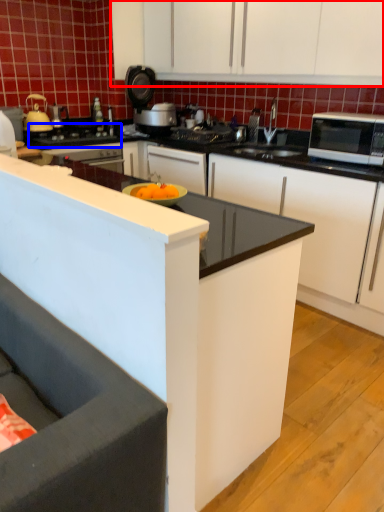
Question: Which point is further to the camera, cabinetry (highlighted by a red box) or gas stove (highlighted by a blue box)?

Choices:
 (A) cabinetry
 (B) gas stove

Answer: (B)